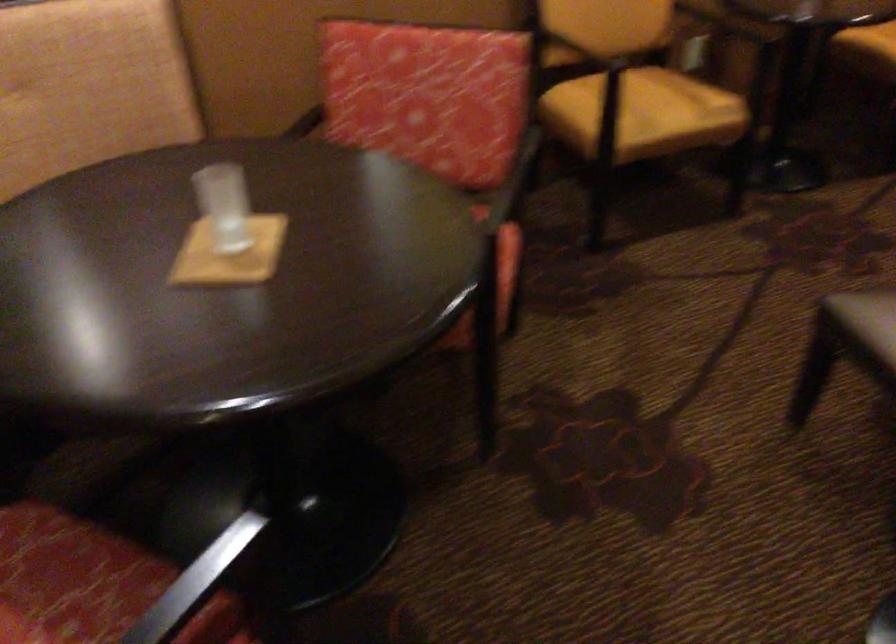
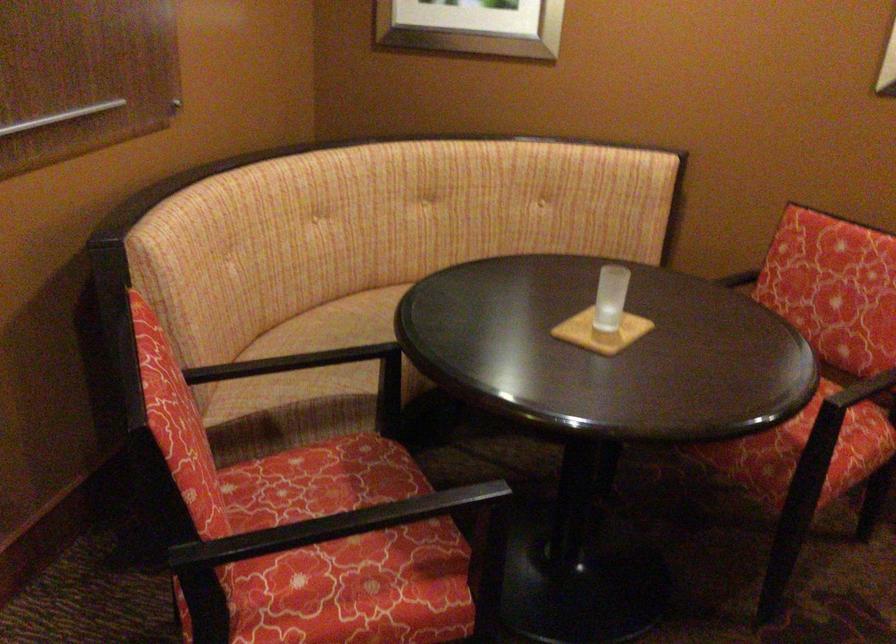
Find the pixel in the second image that matches pixel 495 268 in the first image.

(826, 444)